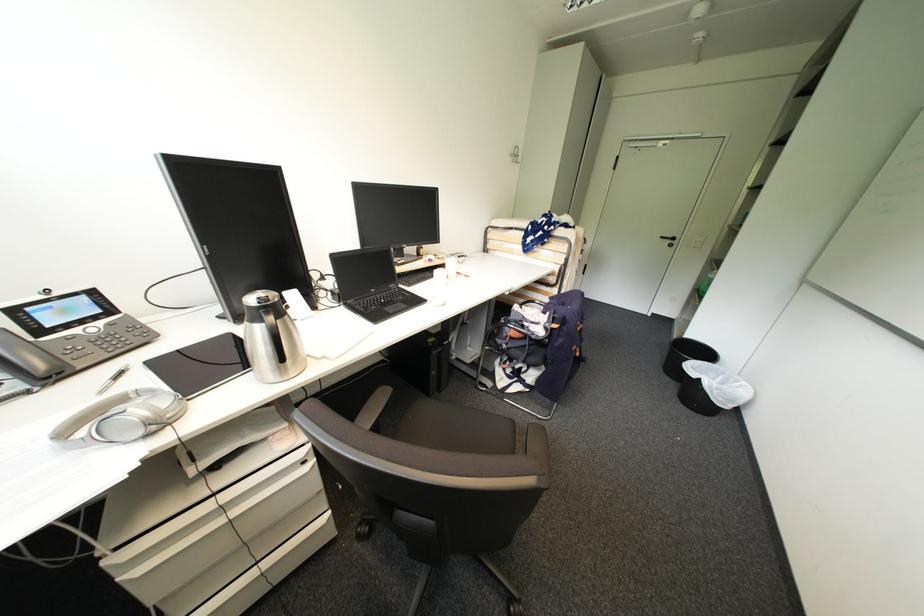
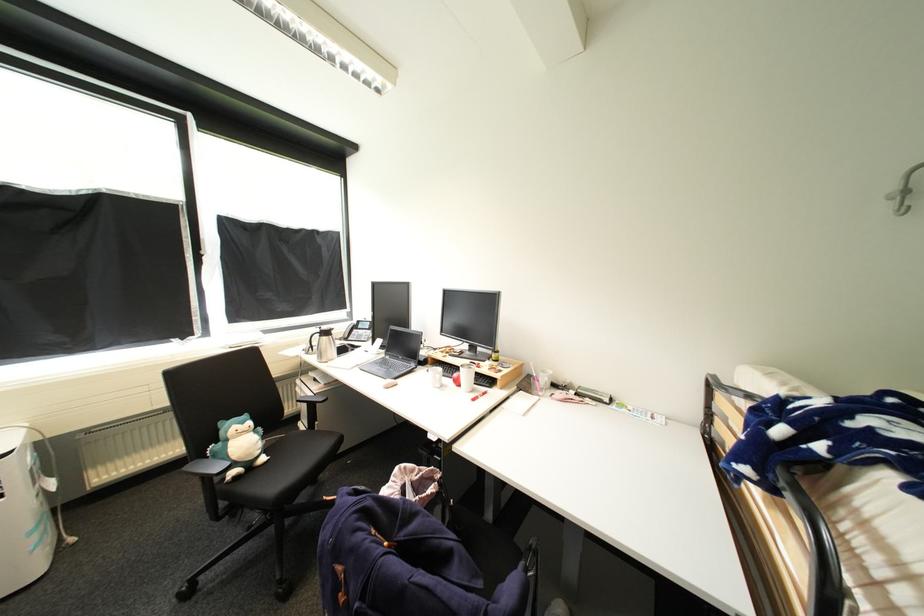
The point at [74,328] is marked in the first image. Where is the corresponding point in the second image?

(367, 330)